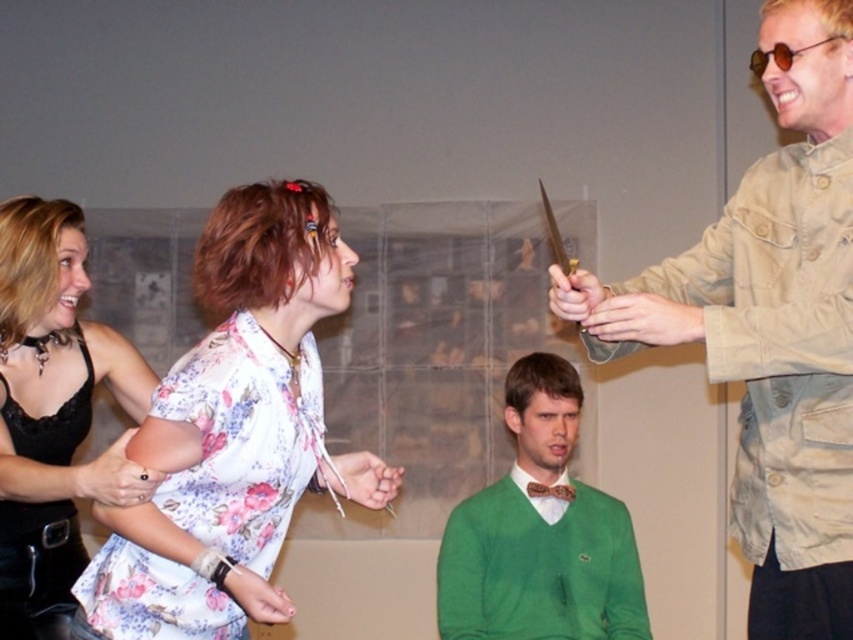
Question: Is matte black leather jacket at left positioned behind green knit sweater at center?

Choices:
 (A) no
 (B) yes

Answer: (A)

Question: Does matte black leather jacket at left have a smaller size compared to green knit sweater at center?

Choices:
 (A) no
 (B) yes

Answer: (A)

Question: Which point appears farthest from the camera in this image?

Choices:
 (A) (544, 588)
 (B) (15, 388)
 (C) (799, 376)

Answer: (A)

Question: Based on their relative distances, which object is farther from the green knit sweater at center?

Choices:
 (A) floral fabric blouse at center
 (B) matte black leather jacket at left

Answer: (B)

Question: Does tan canvas jacket at right appear on the right side of floral fabric blouse at center?

Choices:
 (A) no
 (B) yes

Answer: (B)

Question: Which is farther from the green knit sweater at center?

Choices:
 (A) matte black leather jacket at left
 (B) tan canvas jacket at right
 (C) floral fabric blouse at center

Answer: (B)